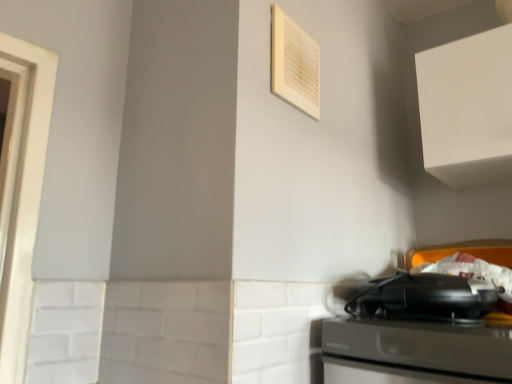
Question: Considering the relative sizes of white plastic air conditioner at upper center and white matte cabinet at upper right in the image provided, is white plastic air conditioner at upper center smaller than white matte cabinet at upper right?

Choices:
 (A) no
 (B) yes

Answer: (B)

Question: From a real-world perspective, is white plastic air conditioner at upper center positioned under white matte cabinet at upper right based on gravity?

Choices:
 (A) no
 (B) yes

Answer: (B)

Question: Does white plastic air conditioner at upper center lie in front of white matte cabinet at upper right?

Choices:
 (A) no
 (B) yes

Answer: (B)

Question: Considering the relative positions of white plastic air conditioner at upper center and white matte cabinet at upper right in the image provided, is white plastic air conditioner at upper center behind white matte cabinet at upper right?

Choices:
 (A) yes
 (B) no

Answer: (B)

Question: Is white plastic air conditioner at upper center completely or partially outside of white matte cabinet at upper right?

Choices:
 (A) yes
 (B) no

Answer: (A)

Question: Can you confirm if white plastic air conditioner at upper center is positioned to the left of white matte cabinet at upper right?

Choices:
 (A) yes
 (B) no

Answer: (A)

Question: From the image's perspective, would you say black plastic toaster at lower right is positioned over white matte cabinet at upper right?

Choices:
 (A) yes
 (B) no

Answer: (B)

Question: Is black plastic toaster at lower right far away from white matte cabinet at upper right?

Choices:
 (A) yes
 (B) no

Answer: (B)

Question: From a real-world perspective, is black plastic toaster at lower right below white matte cabinet at upper right?

Choices:
 (A) no
 (B) yes

Answer: (B)

Question: Is black plastic toaster at lower right completely or partially outside of white matte cabinet at upper right?

Choices:
 (A) yes
 (B) no

Answer: (A)

Question: Is black plastic toaster at lower right taller than white matte cabinet at upper right?

Choices:
 (A) yes
 (B) no

Answer: (B)

Question: Is black plastic toaster at lower right aimed at white matte cabinet at upper right?

Choices:
 (A) yes
 (B) no

Answer: (B)

Question: Does white matte cabinet at upper right come in front of white plastic air conditioner at upper center?

Choices:
 (A) no
 (B) yes

Answer: (A)